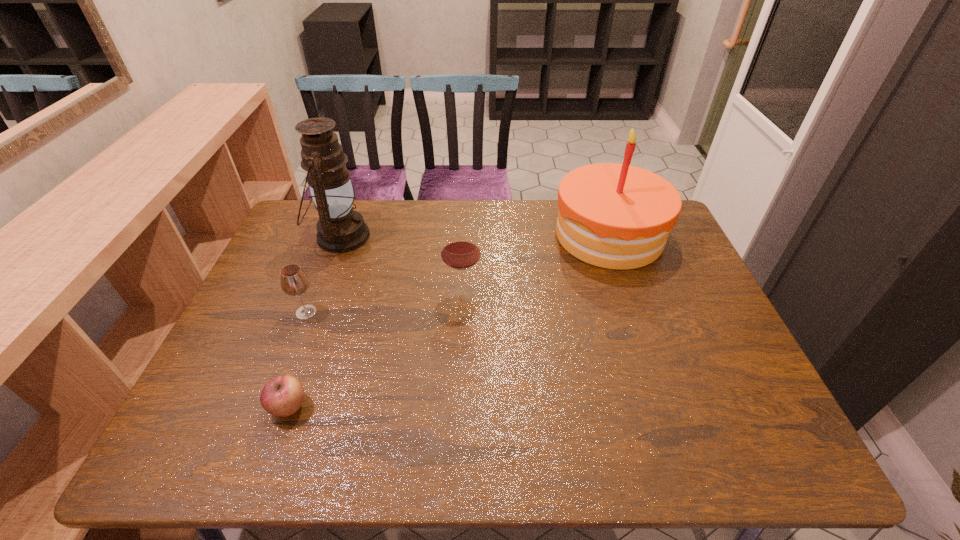
What are the coordinates of `free region located 0.050m on the right of the right wineglass` in the screenshot? It's located at (498, 294).

Identify the location of vacant space located 0.100m on the right of the shorter wineglass. (356, 312).

Find the location of a particular element. vacant area situated 0.310m on the back of the apple is located at coordinates (329, 294).

Identify the location of oil lamp positioned at the far edge. Image resolution: width=960 pixels, height=540 pixels. (340, 229).

Where is `birthday cake at the far edge`? This screenshot has width=960, height=540. birthday cake at the far edge is located at coordinates (616, 216).

You are a GUI agent. You are given a task and a screenshot of the screen. Output one action in this format:
    pyautogui.click(x=<x>, y=<y>)
    Task: Click on the object present at the near edge
    
    Given the screenshot: What is the action you would take?
    pyautogui.click(x=282, y=396)

Locate an element on the screen. The image size is (960, 540). oil lamp that is at the left edge is located at coordinates (340, 229).

The width and height of the screenshot is (960, 540). Find the location of `wineglass present at the left edge`. wineglass present at the left edge is located at coordinates (294, 281).

This screenshot has width=960, height=540. In order to click on object present at the right edge in this screenshot , I will do `click(616, 216)`.

Find the location of a particular element. This screenshot has height=540, width=960. object at the far left corner is located at coordinates (340, 229).